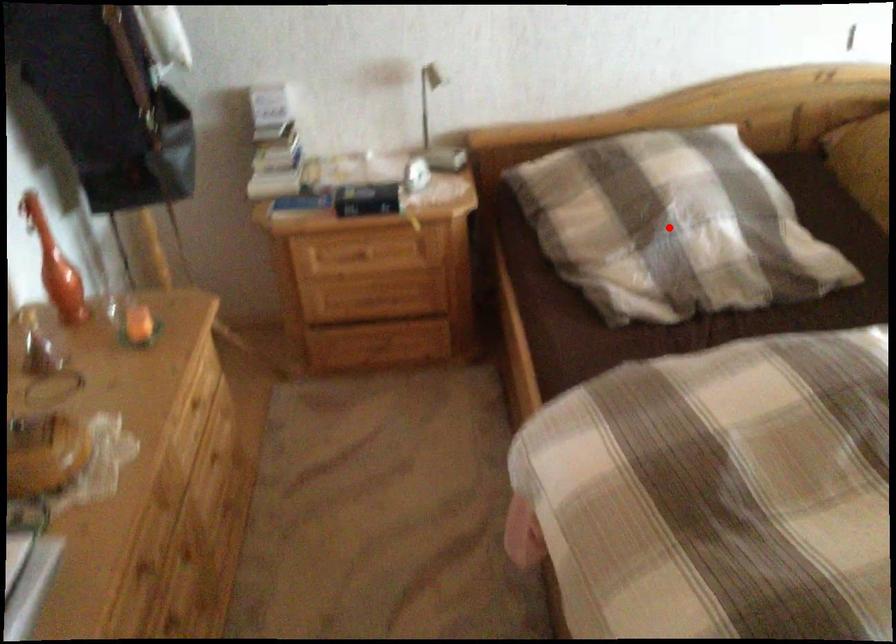
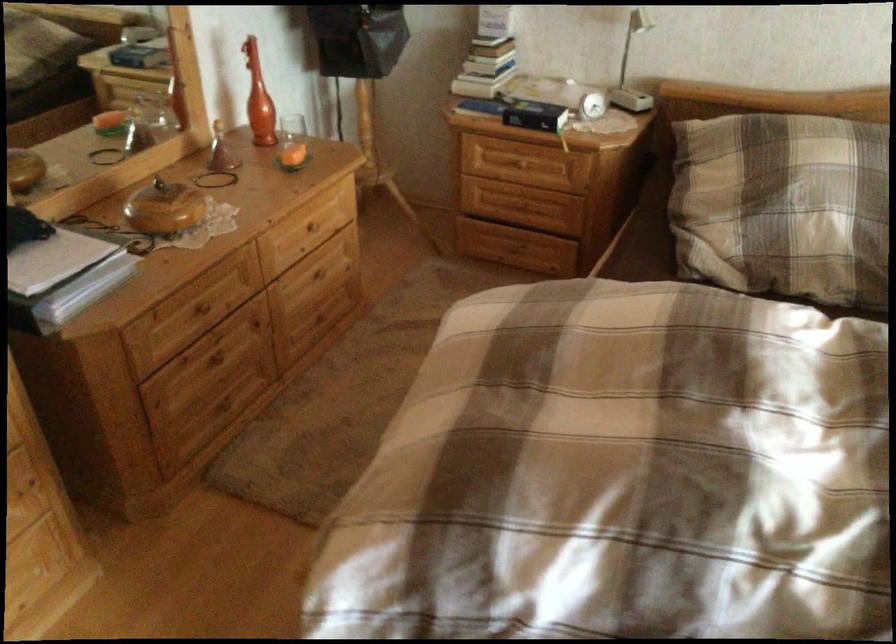
The point at the highlighted location is marked in the first image. Where is the corresponding point in the second image?

(782, 205)